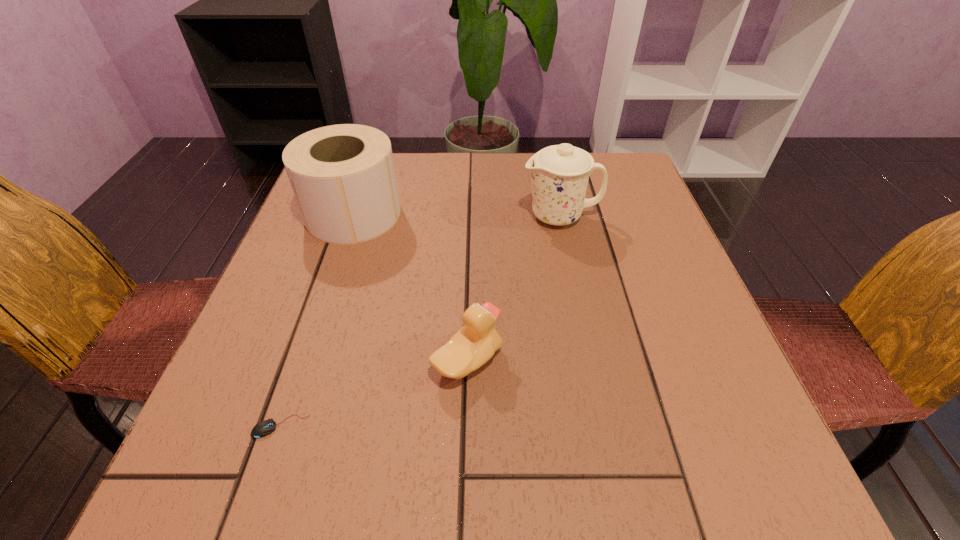
Where is `vacant space that is in between the toilet tissue and the nearest object`? This screenshot has width=960, height=540. vacant space that is in between the toilet tissue and the nearest object is located at coordinates (317, 320).

I want to click on free point between the second object from right to left and the mouse, so click(x=374, y=394).

I want to click on vacant area that lies between the toilet tissue and the chinaware, so click(x=457, y=215).

You are a GUI agent. You are given a task and a screenshot of the screen. Output one action in this format:
    pyautogui.click(x=<x>, y=<y>)
    Task: Click on the free spot between the second nearest object and the rightmost object
    
    Given the screenshot: What is the action you would take?
    pyautogui.click(x=514, y=288)

The width and height of the screenshot is (960, 540). I want to click on vacant space in between the toilet tissue and the rightmost object, so click(457, 215).

Find the location of `free space that is in between the second object from right to left and the rightmost object`. free space that is in between the second object from right to left and the rightmost object is located at coordinates (514, 288).

Select which object appears as the closest to the chinaware. Please provide its 2D coordinates. Your answer should be formatted as a tuple, i.e. [(x, y)], where the tuple contains the x and y coordinates of a point satisfying the conditions above.

[(343, 177)]

Identify which object is the second closest to the chinaware. Please provide its 2D coordinates. Your answer should be formatted as a tuple, i.e. [(x, y)], where the tuple contains the x and y coordinates of a point satisfying the conditions above.

[(475, 343)]

You are a GUI agent. You are given a task and a screenshot of the screen. Output one action in this format:
    pyautogui.click(x=<x>, y=<y>)
    Task: Click on the free region that satisfies the following two spatial constraints: 1. on the back side of the nearest object; 2. on the left side of the toilet tissue
    Image resolution: width=960 pixels, height=540 pixels.
    Given the screenshot: What is the action you would take?
    pyautogui.click(x=352, y=214)